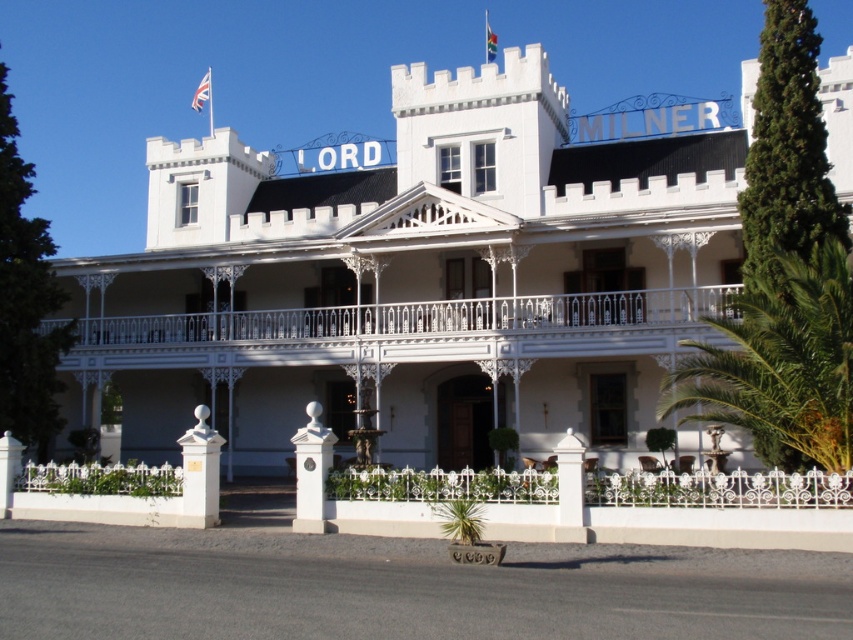
You are standing in front of the grand building and notice a specific location marked by the point coordinates. What object is located at the coordinates point (416,278)?

The point (416,278) indicates a white wrought iron fence at center.

You are a visitor approaching the grand building and notice the white wrought iron fence at center and the green leafy palm at right. Which object appears taller from your perspective?

The white wrought iron fence at center is taller than the green leafy palm at right, so the white wrought iron fence at center appears taller.